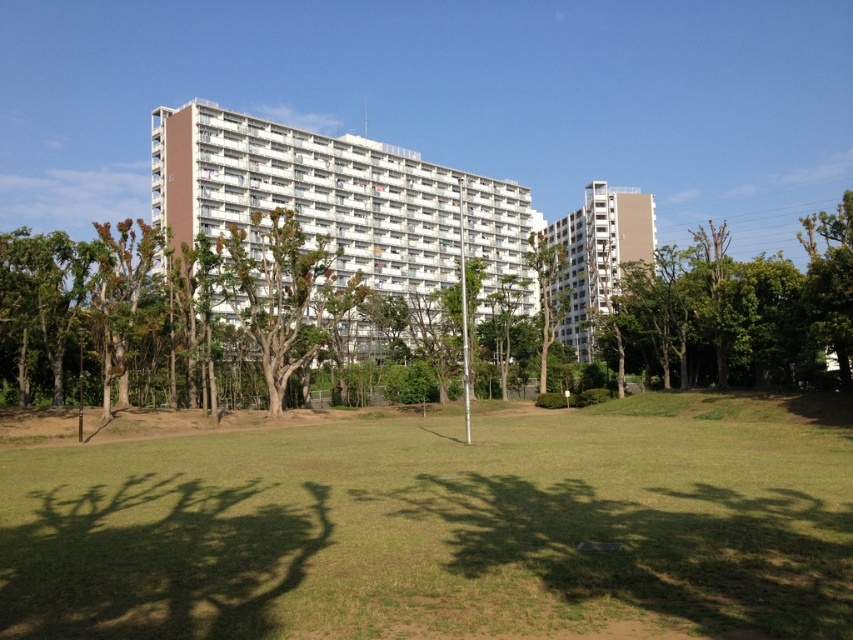
Does white smooth building at center have a greater width compared to green leafy tree at right?

In fact, white smooth building at center might be narrower than green leafy tree at right.

In order to click on white smooth building at center in this screenshot , I will do `click(341, 202)`.

Image resolution: width=853 pixels, height=640 pixels. In order to click on white smooth building at center in this screenshot , I will do `click(341, 202)`.

Between green grass at center and white smooth building at center, which one has more height?

white smooth building at center is taller.

Does green grass at center have a greater width compared to white smooth building at center?

Incorrect, green grass at center's width does not surpass white smooth building at center's.

In order to click on green grass at center in this screenshot , I will do `click(444, 525)`.

I want to click on green grass at center, so click(x=444, y=525).

Can you confirm if green leafy tree at right is positioned to the left of brown textured tree at center?

No, green leafy tree at right is not to the left of brown textured tree at center.

Who is more forward, (776,365) or (335,308)?

Point (776,365) is in front.

Locate an element on the screen. green leafy tree at right is located at coordinates (740, 307).